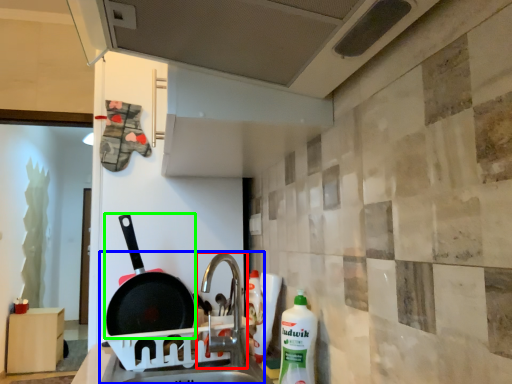
Question: Based on their relative distances, which object is nearer to tap (highlighted by a red box)? Choose from sink (highlighted by a blue box) and frying pan (highlighted by a green box).

Choices:
 (A) sink
 (B) frying pan

Answer: (A)